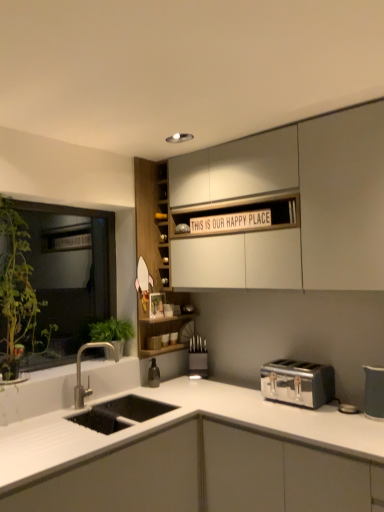
Question: Can you confirm if green leafy plant at left is wider than white matte cabinet at upper center, positioned as the third cabinetry in bottom-to-top order?

Choices:
 (A) yes
 (B) no

Answer: (B)

Question: Can you confirm if green leafy plant at left is shorter than white matte cabinet at upper center, positioned as the third cabinetry in bottom-to-top order?

Choices:
 (A) no
 (B) yes

Answer: (A)

Question: Considering the relative positions of green leafy plant at left and white matte cabinet at upper center, positioned as the third cabinetry in bottom-to-top order, in the image provided, is green leafy plant at left to the right of white matte cabinet at upper center, positioned as the third cabinetry in bottom-to-top order, from the viewer's perspective?

Choices:
 (A) yes
 (B) no

Answer: (B)

Question: Is green leafy plant at left placed right next to white matte cabinet at upper center, positioned as the third cabinetry in bottom-to-top order?

Choices:
 (A) no
 (B) yes

Answer: (A)

Question: Is green leafy plant at left taller than white matte cabinet at upper center, which is counted as the 1th cabinetry, starting from the top?

Choices:
 (A) no
 (B) yes

Answer: (B)

Question: Is green leafy plant at left positioned before white matte cabinet at upper center, which is counted as the 1th cabinetry, starting from the top?

Choices:
 (A) no
 (B) yes

Answer: (A)

Question: Can you confirm if matte gray pitcher at right, positioned as the 2th appliance in left-to-right order, is shorter than white matte cabinet at upper center, which is counted as the 1th cabinetry, starting from the top?

Choices:
 (A) yes
 (B) no

Answer: (A)

Question: Does matte gray pitcher at right, positioned as the 2th appliance in left-to-right order, have a lesser width compared to white matte cabinet at upper center, which is counted as the 1th cabinetry, starting from the top?

Choices:
 (A) yes
 (B) no

Answer: (A)

Question: Is white matte cabinet at upper center, which is counted as the 1th cabinetry, starting from the top, at the back of matte gray pitcher at right, placed as the second appliance when sorted from back to front?

Choices:
 (A) yes
 (B) no

Answer: (B)

Question: Can you confirm if matte gray pitcher at right, which ranks as the first appliance in right-to-left order, is taller than white matte cabinet at upper center, which is counted as the 1th cabinetry, starting from the top?

Choices:
 (A) no
 (B) yes

Answer: (A)

Question: From a real-world perspective, does matte gray pitcher at right, the 1th appliance positioned from the front, sit lower than white matte cabinet at upper center, positioned as the third cabinetry in bottom-to-top order?

Choices:
 (A) no
 (B) yes

Answer: (B)

Question: From a real-world perspective, is matte gray pitcher at right, which ranks as the first appliance in right-to-left order, located higher than white matte cabinet at upper center, positioned as the third cabinetry in bottom-to-top order?

Choices:
 (A) no
 (B) yes

Answer: (A)

Question: From the image's perspective, is satin nickel faucet at lower left beneath wooden cabinet at center, the second cabinetry viewed from the top?

Choices:
 (A) no
 (B) yes

Answer: (B)